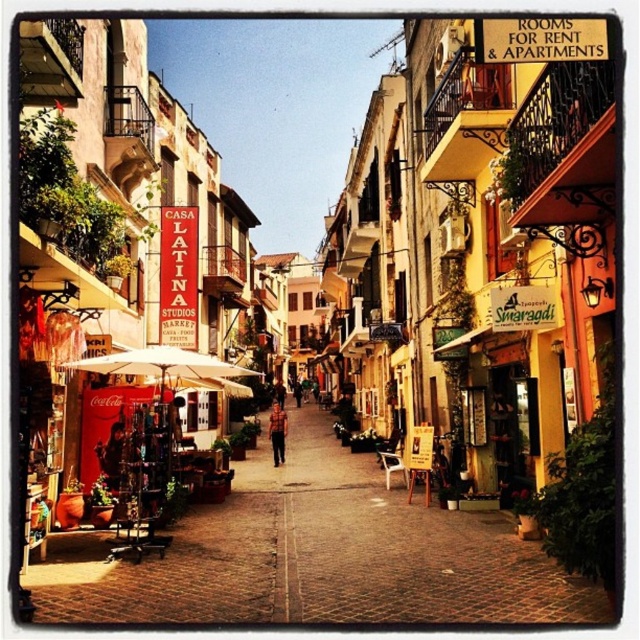
The image size is (640, 640). Identify the location of matte red coca-cola sign at center. (317, 556).

Does matte red coca-cola sign at center appear over brown plaid shirt at center?

Indeed, matte red coca-cola sign at center is positioned over brown plaid shirt at center.

Between point (392, 588) and point (273, 452), which one is positioned in front?

Point (392, 588) is more forward.

In order to click on matte red coca-cola sign at center in this screenshot , I will do `click(317, 556)`.

Which is in front, point (205, 369) or point (272, 406)?

Point (205, 369) is more forward.

Consider the image. Does white fabric umbrella at center appear on the right side of brown plaid shirt at center?

No, white fabric umbrella at center is not to the right of brown plaid shirt at center.

Is point (209, 365) positioned behind point (282, 444)?

No, (209, 365) is closer to viewer.

In order to click on white fabric umbrella at center in this screenshot , I will do `click(168, 365)`.

Is matte red coca-cola sign at center taller than white fabric umbrella at center?

Incorrect, matte red coca-cola sign at center's height is not larger of white fabric umbrella at center's.

Can you confirm if matte red coca-cola sign at center is bigger than white fabric umbrella at center?

Indeed, matte red coca-cola sign at center has a larger size compared to white fabric umbrella at center.

You are a GUI agent. You are given a task and a screenshot of the screen. Output one action in this format:
    pyautogui.click(x=<x>, y=<y>)
    Task: Click on the matte red coca-cola sign at center
    Image resolution: width=640 pixels, height=640 pixels.
    Given the screenshot: What is the action you would take?
    pyautogui.click(x=317, y=556)